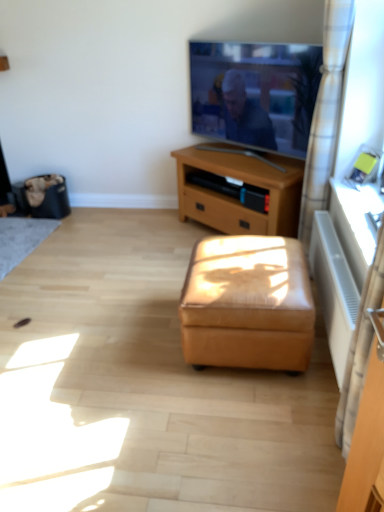
This screenshot has width=384, height=512. I want to click on vacant space positioned to the left of leather ottoman at center, so click(132, 341).